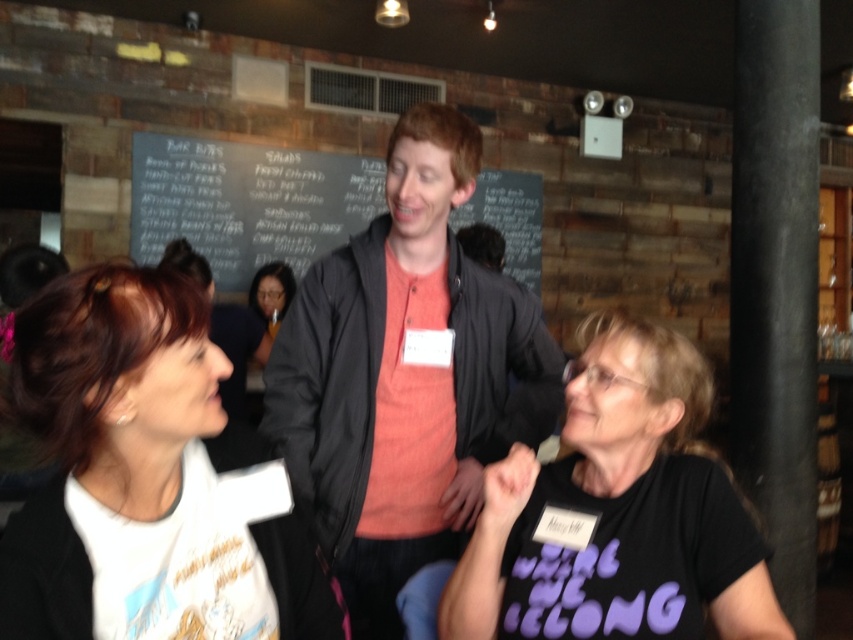
Between chalkboard at center and matte black hair at center, which one is positioned higher?

chalkboard at center is above.

Which is in front, point (541, 186) or point (273, 280)?

Positioned in front is point (273, 280).

Where is `chalkboard at center`? chalkboard at center is located at coordinates (247, 202).

Looking at this image, is the position of black smooth pole at right more distant than that of chalkboard at center?

No, black smooth pole at right is closer to the viewer.

Locate an element on the screen. This screenshot has width=853, height=640. black smooth pole at right is located at coordinates (776, 285).

Who is more forward, (775, 102) or (306, 252)?

Point (775, 102) is in front.

Find the location of a particular element. The height and width of the screenshot is (640, 853). black smooth pole at right is located at coordinates pos(776,285).

Can you confirm if orange cotton shirt at center is positioned to the right of chalkboard at center?

Correct, you'll find orange cotton shirt at center to the right of chalkboard at center.

Is point (375, 237) less distant than point (241, 161)?

Yes, it is.

Between point (532, 316) and point (131, 236), which one is positioned behind?

Point (131, 236)

Locate an element on the screen. This screenshot has height=640, width=853. orange cotton shirt at center is located at coordinates (405, 376).